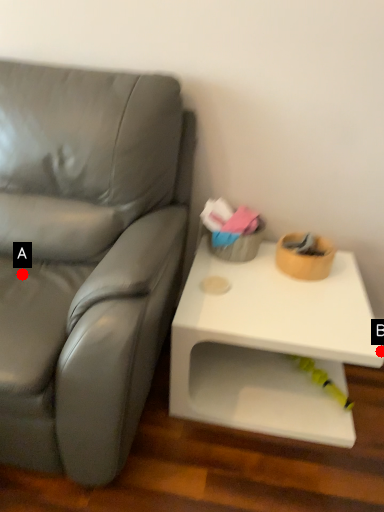
Question: Two points are circled on the image, labeled by A and B beside each circle. Which point is closer to the camera taking this photo?

Choices:
 (A) A is closer
 (B) B is closer

Answer: (B)